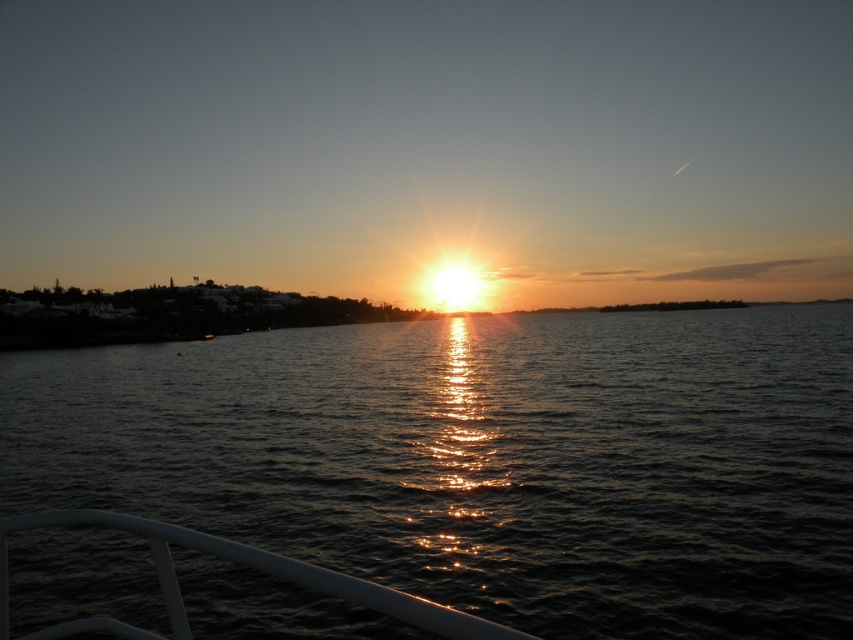
Question: Which point is farther from the camera taking this photo?

Choices:
 (A) (283, 560)
 (B) (677, 449)

Answer: (B)

Question: Is glistening water at center bigger than white glossy rail at lower center?

Choices:
 (A) yes
 (B) no

Answer: (A)

Question: Considering the relative positions of glistening water at center and white glossy rail at lower center in the image provided, where is glistening water at center located with respect to white glossy rail at lower center?

Choices:
 (A) below
 (B) above

Answer: (B)

Question: Which point is closer to the camera?

Choices:
 (A) (9, 525)
 (B) (787, 452)

Answer: (A)

Question: Is glistening water at center bigger than white glossy rail at lower center?

Choices:
 (A) no
 (B) yes

Answer: (B)